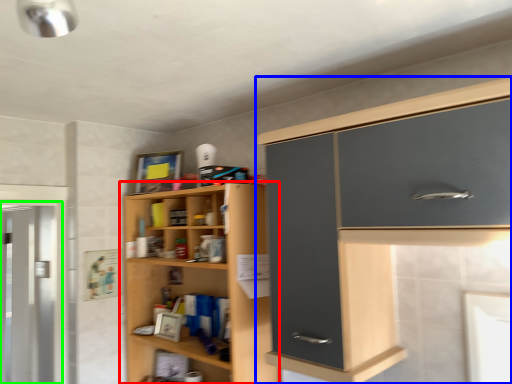
Question: Which object is positioned closest to cupboard (highlighted by a red box)? Select from cabinetry (highlighted by a blue box) and screen door (highlighted by a green box).

Choices:
 (A) cabinetry
 (B) screen door

Answer: (A)